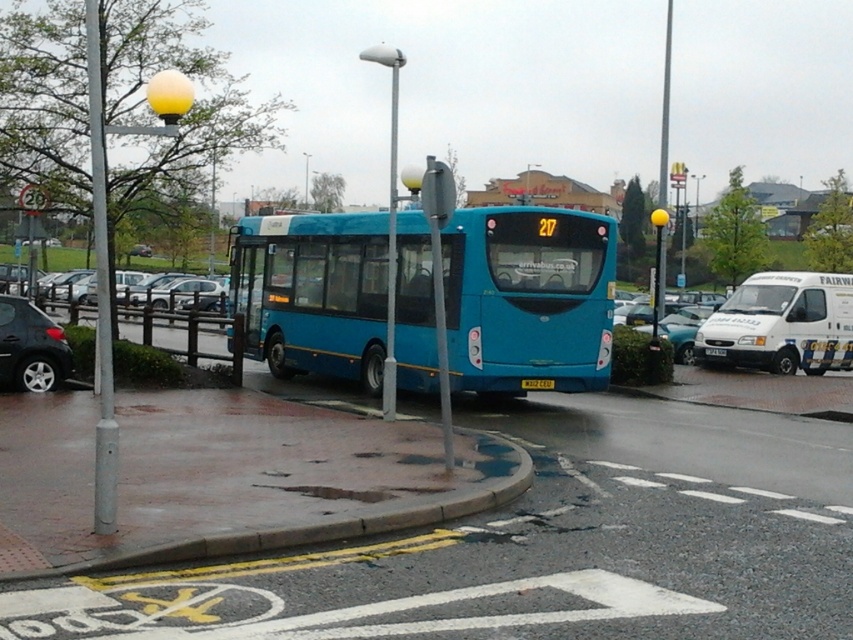
Can you confirm if blue metallic bus at center is thinner than metallic silver car at right?

Yes, blue metallic bus at center is thinner than metallic silver car at right.

Is blue metallic bus at center wider than metallic silver car at right?

In fact, blue metallic bus at center might be narrower than metallic silver car at right.

Which is behind, point (425, 276) or point (705, 308)?

The point (705, 308) is more distant.

At what (x,y) coordinates should I click in order to perform the action: click on blue metallic bus at center. Please return your answer as a coordinate pair (x, y). Image resolution: width=853 pixels, height=640 pixels. Looking at the image, I should click on [527, 298].

Is shiny black car at left above metallic silver car at right?

No.

Measure the distance from shiny black car at left to metallic silver car at right.

shiny black car at left and metallic silver car at right are 13.96 meters apart from each other.

Does point (50, 323) come closer to viewer compared to point (689, 328)?

That is True.

Where is `shiny black car at left`? The height and width of the screenshot is (640, 853). shiny black car at left is located at coordinates (30, 348).

Does blue metallic bus at center appear over yellow plastic license plate at center?

Indeed, blue metallic bus at center is positioned over yellow plastic license plate at center.

Is point (555, 324) positioned in front of point (706, 353)?

That is True.

Find the location of a particular element. blue metallic bus at center is located at coordinates (527, 298).